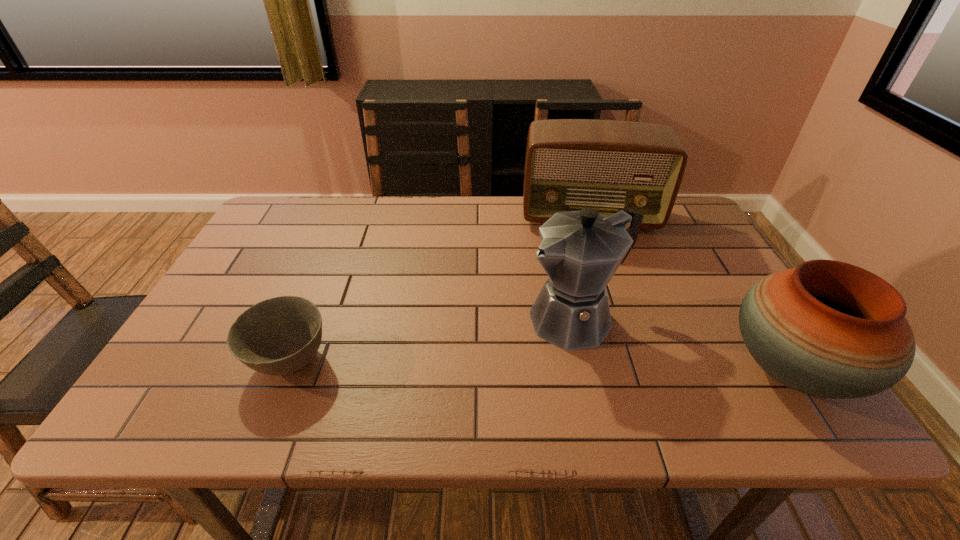
In order to click on the shortest object in this screenshot , I will do `click(278, 336)`.

Locate an element on the screen. This screenshot has height=540, width=960. bowl is located at coordinates (278, 336).

What are the coordinates of `pottery` in the screenshot? It's located at (826, 328).

Find the location of a particular element. The image size is (960, 540). coffeepot is located at coordinates (580, 251).

At what (x,y) coordinates should I click in order to perform the action: click on the farthest object. Please return your answer as a coordinate pair (x, y). Looking at the image, I should click on (608, 165).

At what (x,y) coordinates should I click in order to perform the action: click on free spot located 0.110m on the back of the shortest object. Please return your answer as a coordinate pair (x, y). The height and width of the screenshot is (540, 960). Looking at the image, I should click on (316, 296).

The width and height of the screenshot is (960, 540). I want to click on vacant space located on the left of the pottery, so click(588, 369).

Identify the location of blank space located at the spout of the coffeepot. (470, 366).

The image size is (960, 540). Identify the location of vacant space positioned at the spout of the coffeepot. (491, 356).

The width and height of the screenshot is (960, 540). Identify the location of free space located at the spout of the coffeepot. (502, 351).